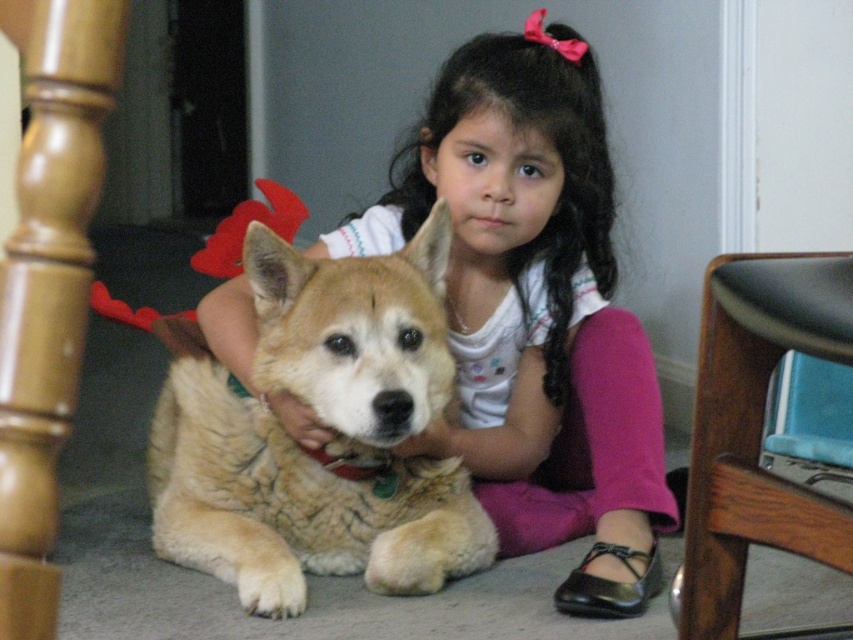
Does smooth white shirt at center come behind wooden chair at lower right?

Yes, it is behind wooden chair at lower right.

Is point (585, 490) less distant than point (804, 518)?

No.

Does point (521, 257) come behind point (782, 492)?

That is True.

The width and height of the screenshot is (853, 640). Identify the location of smooth white shirt at center. (535, 310).

Does smooth white shirt at center have a larger size compared to golden fur dog at center?

Yes, smooth white shirt at center is bigger than golden fur dog at center.

The image size is (853, 640). Describe the element at coordinates (535, 310) in the screenshot. I see `smooth white shirt at center` at that location.

Where is `smooth white shirt at center`? Image resolution: width=853 pixels, height=640 pixels. smooth white shirt at center is located at coordinates (535, 310).

Is the position of golden fur dog at center less distant than that of wooden chair at lower right?

No.

Is golden fur dog at center taller than wooden chair at lower right?

Indeed, golden fur dog at center has a greater height compared to wooden chair at lower right.

Who is more distant from viewer, (409, 376) or (755, 308)?

Positioned behind is point (409, 376).

Image resolution: width=853 pixels, height=640 pixels. I want to click on golden fur dog at center, so click(x=294, y=504).